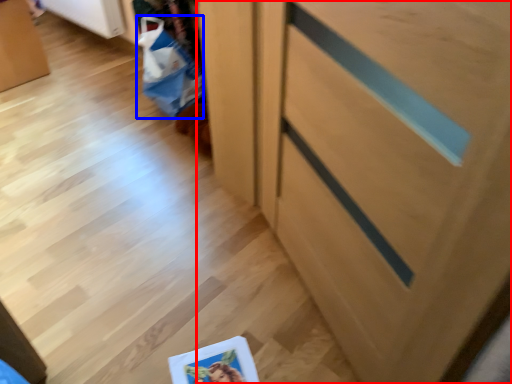
Question: Which object is closer to the camera taking this photo, cabinetry (highlighted by a red box) or shopping bag (highlighted by a blue box)?

Choices:
 (A) cabinetry
 (B) shopping bag

Answer: (A)